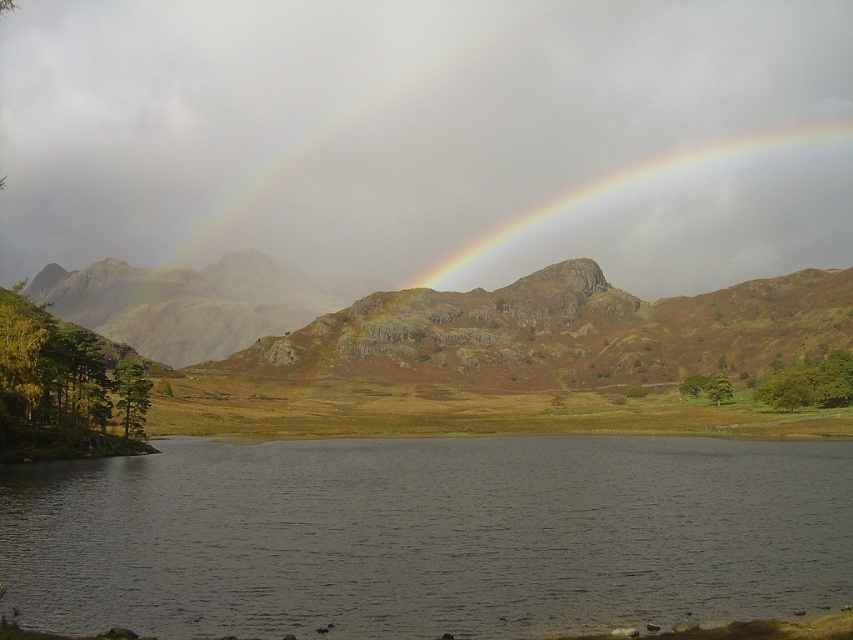
You are standing at the edge of the lake and notice a point marked at coordinates (427, 536). Based on the scene description, what does this point likely represent?

The point at (427, 536) marks dark water at lower center, which is part of the tranquil lake described in the scene.

You are standing at the edge of the lake in the serene landscape. You notice two points in the sky where the rainbows form. Which of the two points, point 1 at coordinates point (711, 326) or point 2 at coordinates point (647, 333), is closer to you?

Point 1 at coordinates point (711, 326) is closer to the viewer than point 2 at coordinates point (647, 333).